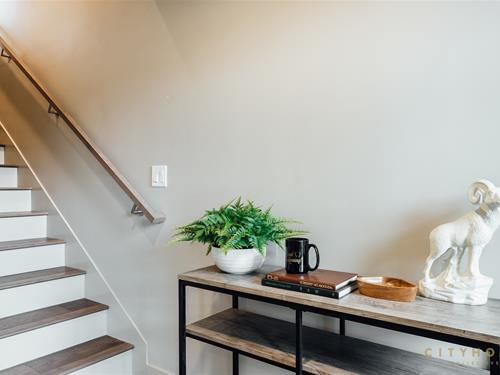
This screenshot has width=500, height=375. What are the coordinates of `stair rail` in the screenshot? It's located at (129, 191).